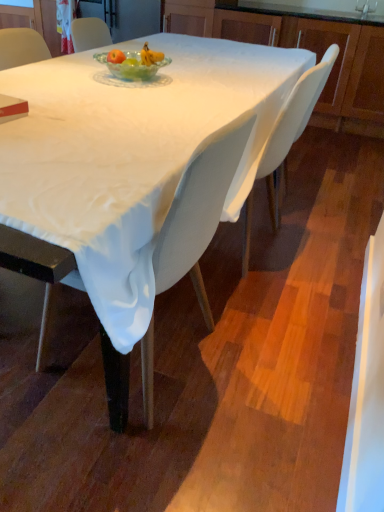
This screenshot has width=384, height=512. What are the coordinates of `free space in front of white fabric chair at center, placed as the second chair when sorted from right to left` in the screenshot? It's located at (115, 456).